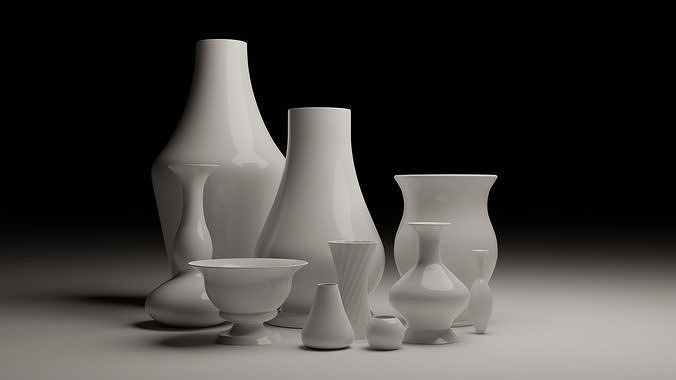
Find the location of a particular element. 2 large vases is located at coordinates (197, 117), (314, 175).